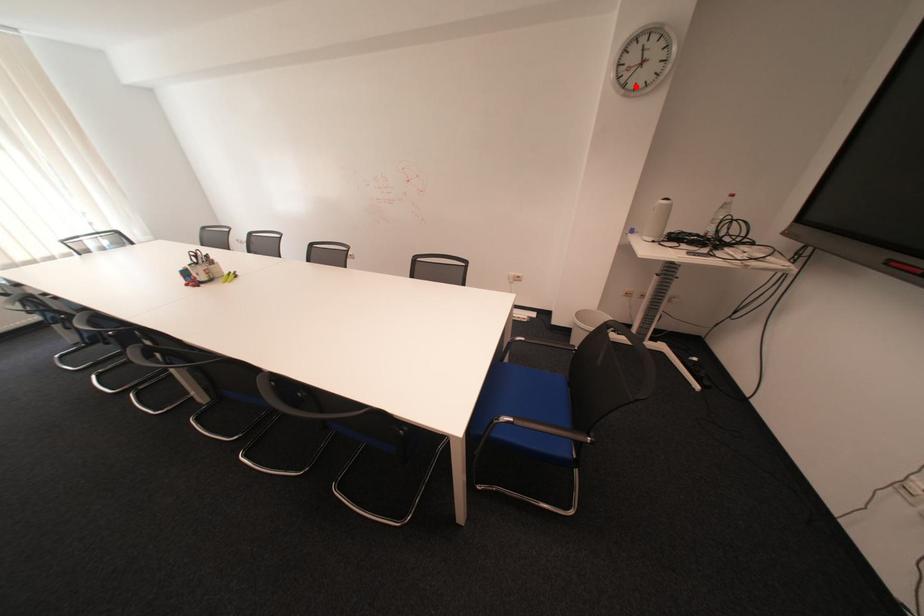
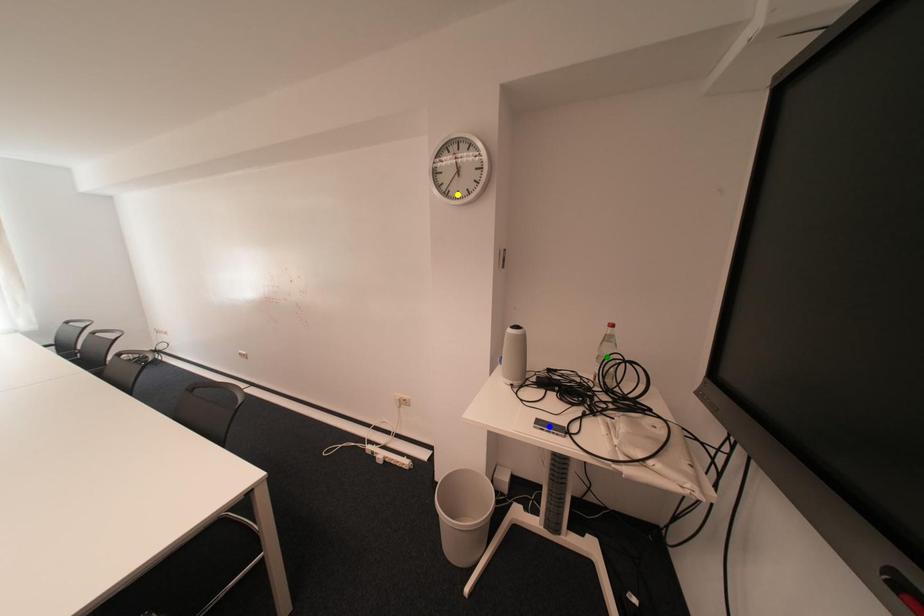
Question: I am providing you with two images of the same scene from different viewpoints. A red point is marked on the first image. You are given multiple points on the second image. Can you choose the point in image 2 that corresponds to the point in image 1?

Choices:
 (A) yellow point
 (B) green point
 (C) blue point

Answer: (A)